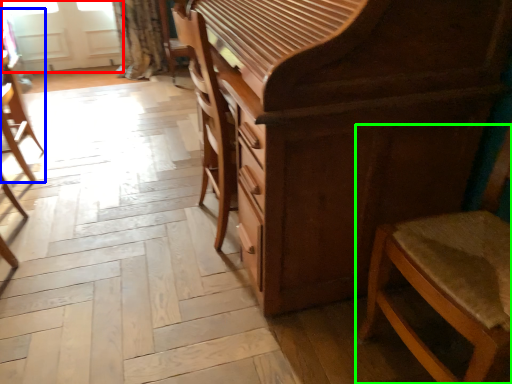
Question: Which object is the closest to the screen door (highlighted by a red box)? Choose among these: chair (highlighted by a blue box) or chair (highlighted by a green box).

Choices:
 (A) chair
 (B) chair

Answer: (A)